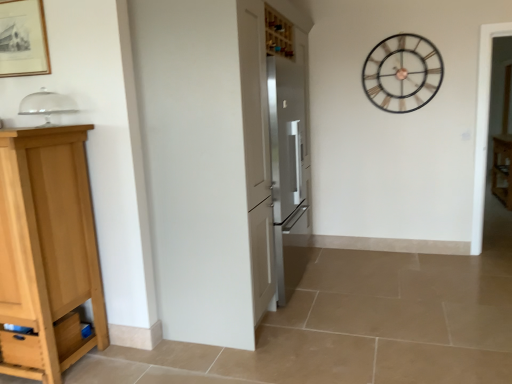
Question: From the image's perspective, is clear glass dome at upper left, marked as the 1th appliance in a top-to-bottom arrangement, located above wooden cabinet at right, the first cabinetry when ordered from right to left?

Choices:
 (A) yes
 (B) no

Answer: (A)

Question: Is clear glass dome at upper left, the second appliance when ordered from right to left, not inside wooden cabinet at right, the first cabinetry when ordered from right to left?

Choices:
 (A) yes
 (B) no

Answer: (A)

Question: Is clear glass dome at upper left, arranged as the second appliance when ordered from the bottom, touching wooden cabinet at right, which ranks as the 2th cabinetry in left-to-right order?

Choices:
 (A) yes
 (B) no

Answer: (B)

Question: Is clear glass dome at upper left, the 2th appliance in the back-to-front sequence, oriented away from wooden cabinet at right, which is the 2th cabinetry in front-to-back order?

Choices:
 (A) no
 (B) yes

Answer: (A)

Question: Considering the relative sizes of clear glass dome at upper left, arranged as the second appliance when ordered from the bottom, and wooden cabinet at right, the first cabinetry when ordered from right to left, in the image provided, is clear glass dome at upper left, arranged as the second appliance when ordered from the bottom, thinner than wooden cabinet at right, the first cabinetry when ordered from right to left,?

Choices:
 (A) no
 (B) yes

Answer: (B)

Question: Is clear glass dome at upper left, acting as the 1th appliance starting from the left, smaller than wooden cabinet at right, which ranks as the 2th cabinetry in left-to-right order?

Choices:
 (A) no
 (B) yes

Answer: (B)

Question: From a real-world perspective, is wooden cabinet at right, the first cabinetry when ordered from right to left, beneath metallic gold clock at upper right?

Choices:
 (A) yes
 (B) no

Answer: (A)

Question: Is wooden cabinet at right, the first cabinetry when ordered from right to left, at the right side of metallic gold clock at upper right?

Choices:
 (A) yes
 (B) no

Answer: (A)

Question: Could you tell me if wooden cabinet at right, the first cabinetry when ordered from right to left, is facing metallic gold clock at upper right?

Choices:
 (A) yes
 (B) no

Answer: (B)

Question: Is wooden cabinet at right, which is the 2th cabinetry in front-to-back order, in front of metallic gold clock at upper right?

Choices:
 (A) no
 (B) yes

Answer: (A)

Question: Considering the relative sizes of wooden cabinet at right, placed as the first cabinetry when sorted from back to front, and metallic gold clock at upper right in the image provided, is wooden cabinet at right, placed as the first cabinetry when sorted from back to front, smaller than metallic gold clock at upper right?

Choices:
 (A) no
 (B) yes

Answer: (A)

Question: Can you confirm if wooden cabinet at right, which ranks as the 2th cabinetry in left-to-right order, is bigger than metallic gold clock at upper right?

Choices:
 (A) yes
 (B) no

Answer: (A)

Question: Does satin silver refrigerator at center, the 1th appliance from the right, have a larger size compared to metallic gold clock at upper right?

Choices:
 (A) no
 (B) yes

Answer: (B)